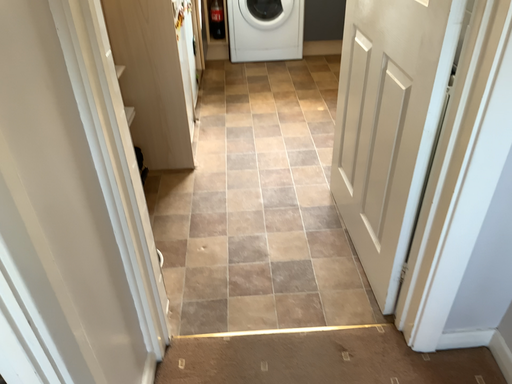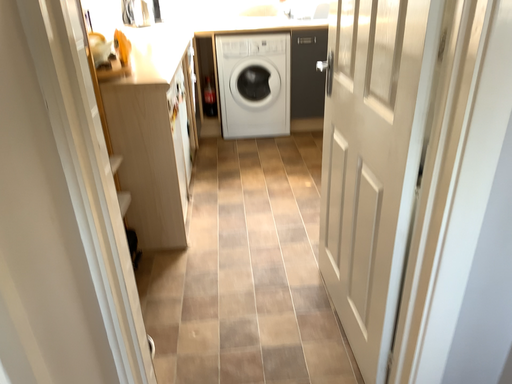
Question: How did the camera likely rotate when shooting the video?

Choices:
 (A) rotated downward
 (B) rotated upward

Answer: (B)